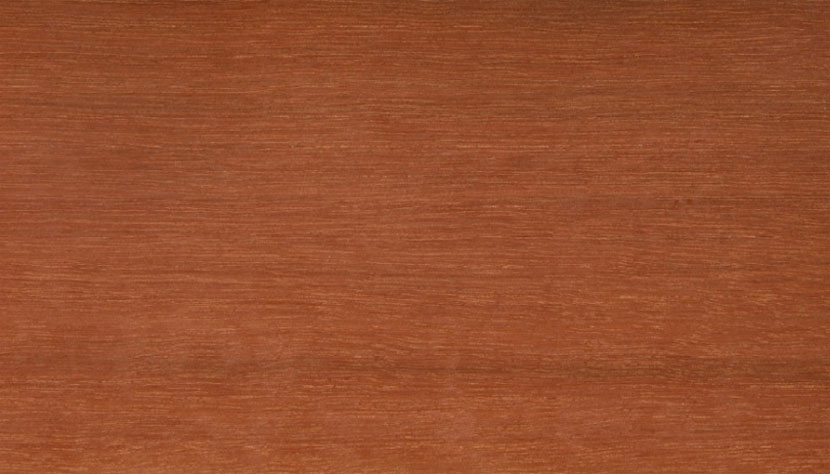
I want to click on table, so click(x=164, y=167), click(x=418, y=271), click(x=706, y=400).